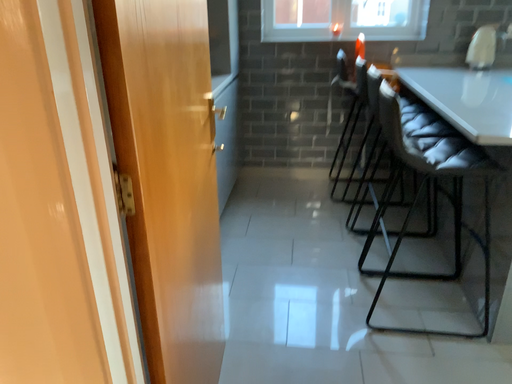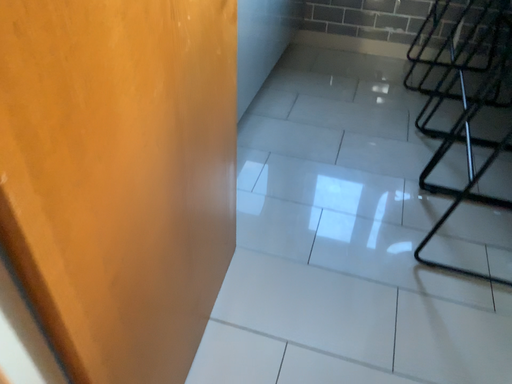
Question: How did the camera likely rotate when shooting the video?

Choices:
 (A) rotated downward
 (B) rotated upward

Answer: (A)